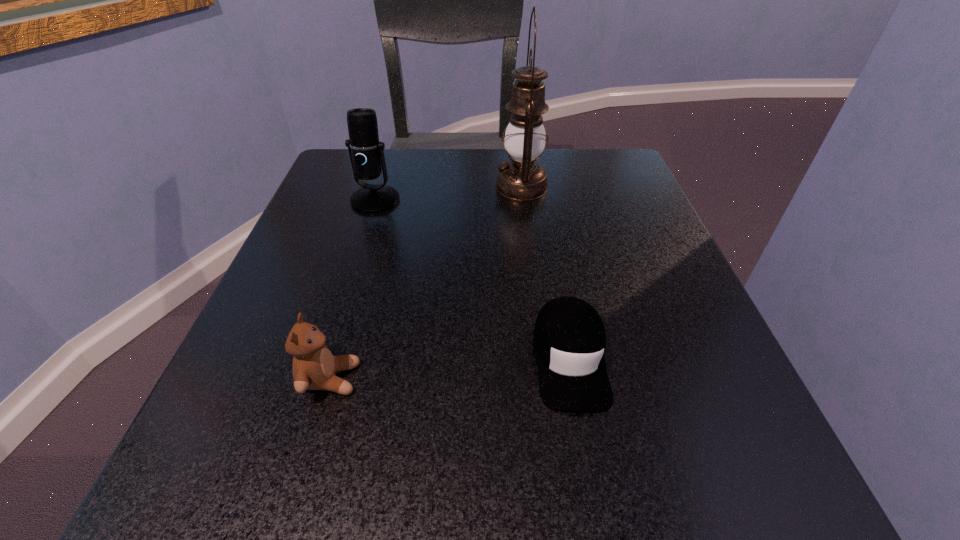
Identify the location of vacant space that's between the third tallest object and the oil lamp. (426, 282).

Identify the location of vacant region between the teddy bear and the shortest object. (449, 369).

Identify the location of vacant area that lies between the tallest object and the cap. (545, 273).

What are the coordinates of `free spot between the shortest object and the teddy bear` in the screenshot? It's located at (449, 369).

Locate an element on the screen. free space between the tallest object and the shortest object is located at coordinates (545, 273).

This screenshot has height=540, width=960. Identify the location of empty space that is in between the microphone and the third tallest object. (353, 289).

You are a GUI agent. You are given a task and a screenshot of the screen. Output one action in this format:
    pyautogui.click(x=<x>, y=<y>)
    Task: Click on the vacant point located between the teddy bear and the tallest object
    Image resolution: width=960 pixels, height=540 pixels.
    Given the screenshot: What is the action you would take?
    pyautogui.click(x=426, y=282)

Where is `free area in between the microphone and the second shortest object`? free area in between the microphone and the second shortest object is located at coordinates (353, 289).

Locate an element on the screen. The image size is (960, 540). free space between the microphone and the tallest object is located at coordinates click(x=448, y=193).

Where is `object that is the third closest to the tallest object`? object that is the third closest to the tallest object is located at coordinates (314, 367).